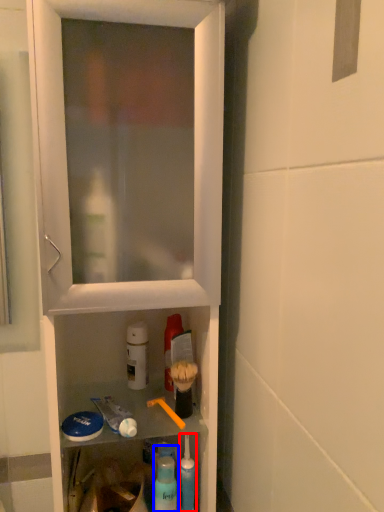
Question: Which object is closer to the camera taking this photo, toiletry (highlighted by a red box) or cleaning product (highlighted by a blue box)?

Choices:
 (A) toiletry
 (B) cleaning product

Answer: (B)